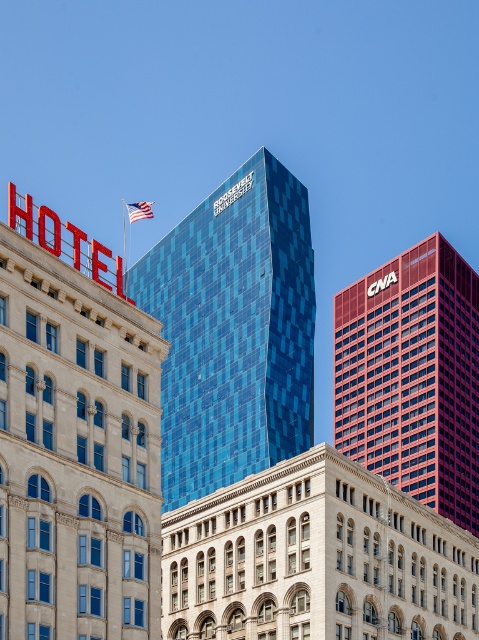
You are a city planner assessing the skyline. The matte red building at right and the american flag at upper center are both visible from a nearby park. Which one appears taller in the sky?

The matte red building at right is much taller than the american flag at upper center, so it appears taller in the sky.

What is located at the coordinates point (x=234, y=330) in the image?

The blue glass building at center is located at point (x=234, y=330).

You are standing on the street looking at the urban skyline. You see the blue glass building at center and the american flag at upper center. Which object is higher in the scene?

The american flag at upper center is higher than the blue glass building at center because the blue glass building at center is below the american flag at upper center.